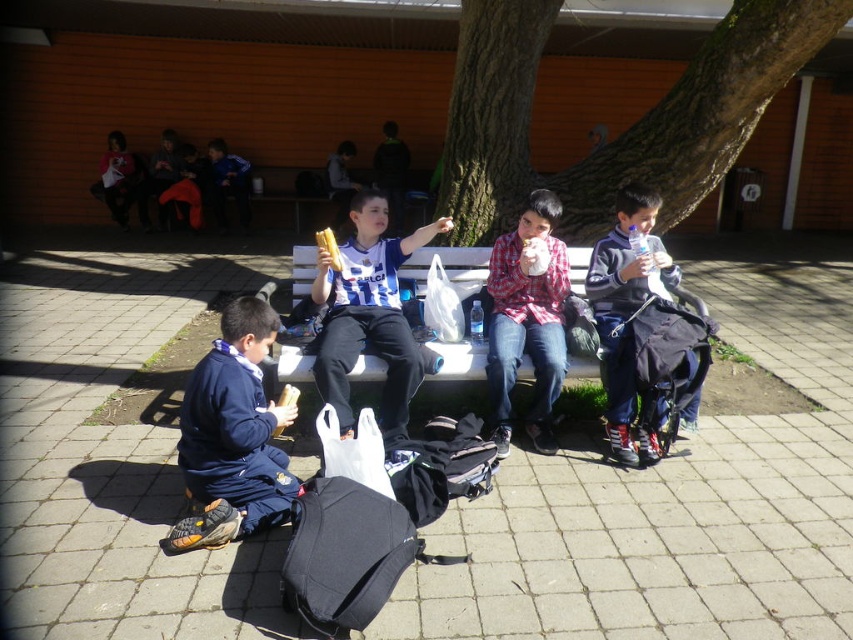
You are a photographer standing in front of the green rough bark tree at center and the matte blue and white jersey at center. Which object is closer to you?

The green rough bark tree at center is closer to you than the matte blue and white jersey at center.